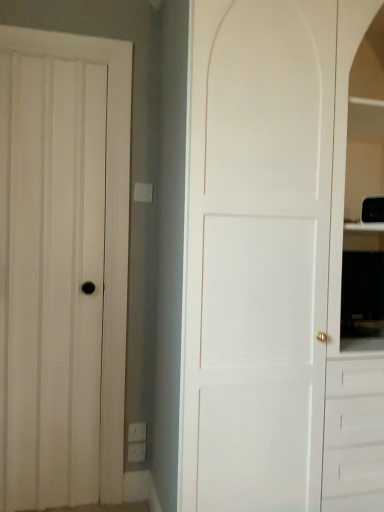
Question: From the image's perspective, is white matte door at right, the second door when ordered from left to right, located above white matte door at left, arranged as the first door when viewed from the left?

Choices:
 (A) no
 (B) yes

Answer: (B)

Question: Is white matte door at right, the second door when ordered from left to right, at the right side of white matte door at left, arranged as the first door when viewed from the left?

Choices:
 (A) no
 (B) yes

Answer: (B)

Question: Would you say white matte door at right, the second door when ordered from left to right, contains white matte door at left, arranged as the first door when viewed from the left?

Choices:
 (A) yes
 (B) no

Answer: (B)

Question: Can you confirm if white matte door at right, the second door when ordered from left to right, is wider than white matte door at left, arranged as the first door when viewed from the left?

Choices:
 (A) yes
 (B) no

Answer: (A)

Question: Is the depth of white matte door at right, the first door positioned from the right, greater than that of white matte door at left, arranged as the first door when viewed from the left?

Choices:
 (A) yes
 (B) no

Answer: (B)

Question: Does white matte door at right, the second door when ordered from left to right, turn towards white matte door at left, arranged as the first door when viewed from the left?

Choices:
 (A) no
 (B) yes

Answer: (A)

Question: Is white matte door at left, the 2th door from the right, to the left of white matte door at right, the second door when ordered from left to right, from the viewer's perspective?

Choices:
 (A) no
 (B) yes

Answer: (B)

Question: Considering the relative positions of white matte door at left, the 2th door from the right, and white matte door at right, the second door when ordered from left to right, in the image provided, is white matte door at left, the 2th door from the right, behind white matte door at right, the second door when ordered from left to right,?

Choices:
 (A) no
 (B) yes

Answer: (B)

Question: Is white matte door at left, arranged as the first door when viewed from the left, at the right side of white matte door at right, the second door when ordered from left to right?

Choices:
 (A) yes
 (B) no

Answer: (B)

Question: Considering the relative sizes of white matte door at left, arranged as the first door when viewed from the left, and white matte door at right, the first door positioned from the right, in the image provided, is white matte door at left, arranged as the first door when viewed from the left, bigger than white matte door at right, the first door positioned from the right,?

Choices:
 (A) yes
 (B) no

Answer: (B)

Question: Is white matte door at left, the 2th door from the right, not inside white matte door at right, the second door when ordered from left to right?

Choices:
 (A) no
 (B) yes

Answer: (B)

Question: Is white matte door at left, the 2th door from the right, looking in the opposite direction of white matte door at right, the first door positioned from the right?

Choices:
 (A) yes
 (B) no

Answer: (B)

Question: Based on their sizes in the image, would you say white matte door at left, arranged as the first door when viewed from the left, is bigger or smaller than white matte door at right, the second door when ordered from left to right?

Choices:
 (A) small
 (B) big

Answer: (A)